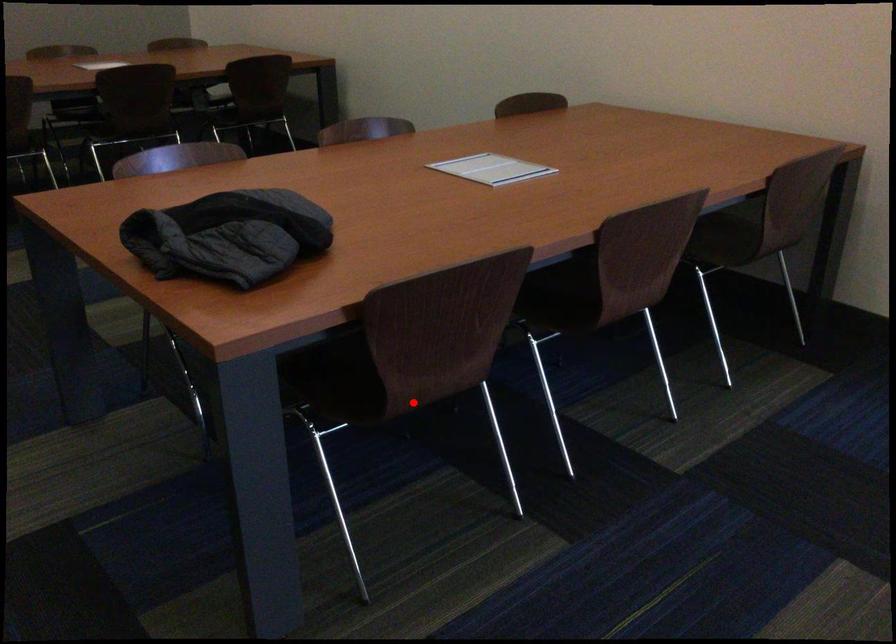
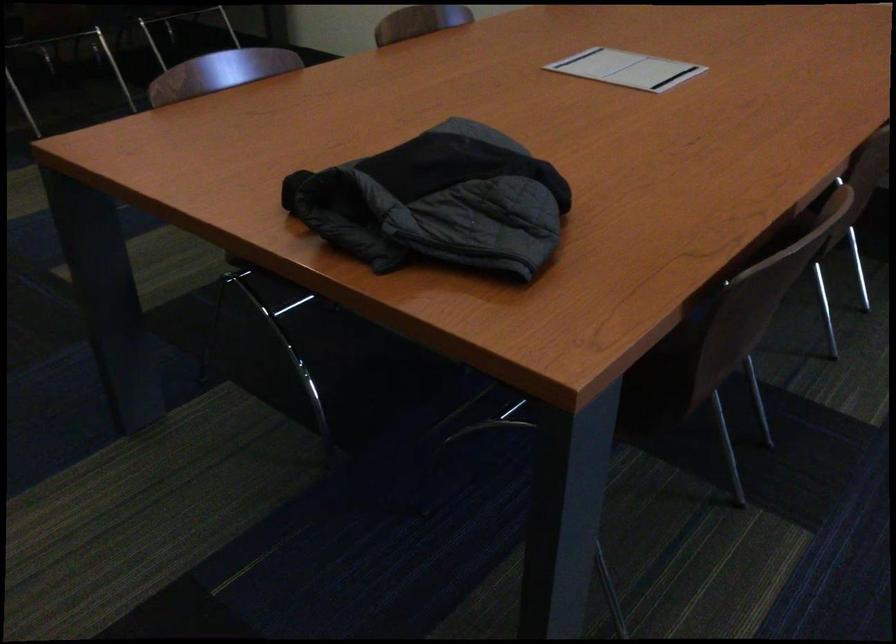
Question: I am providing you with two images of the same scene from different viewpoints. Image1 has a red point marked. In image2, the corresponding 3D location appears at what relative position? Reply with the corresponding letter.

Choices:
 (A) Closer
 (B) Farther

Answer: (A)